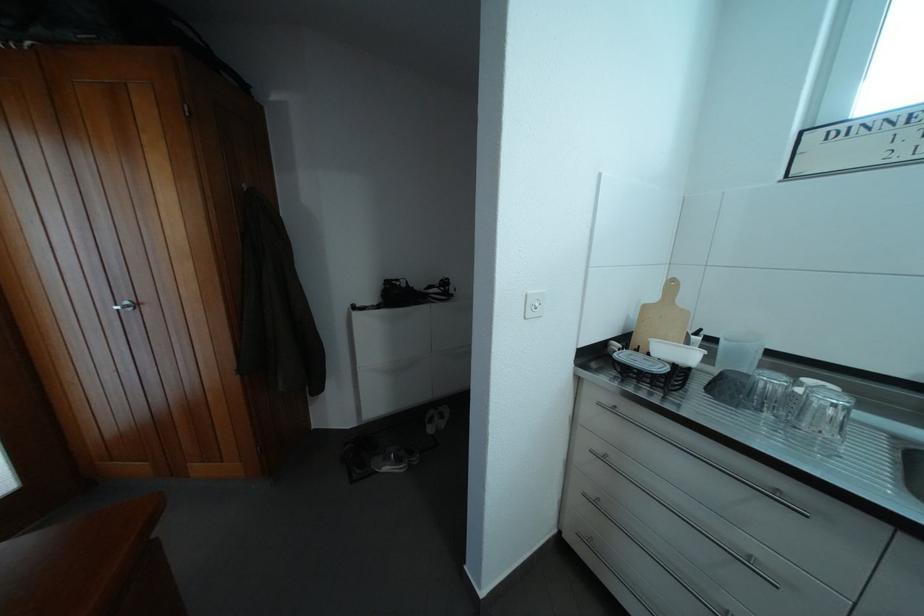
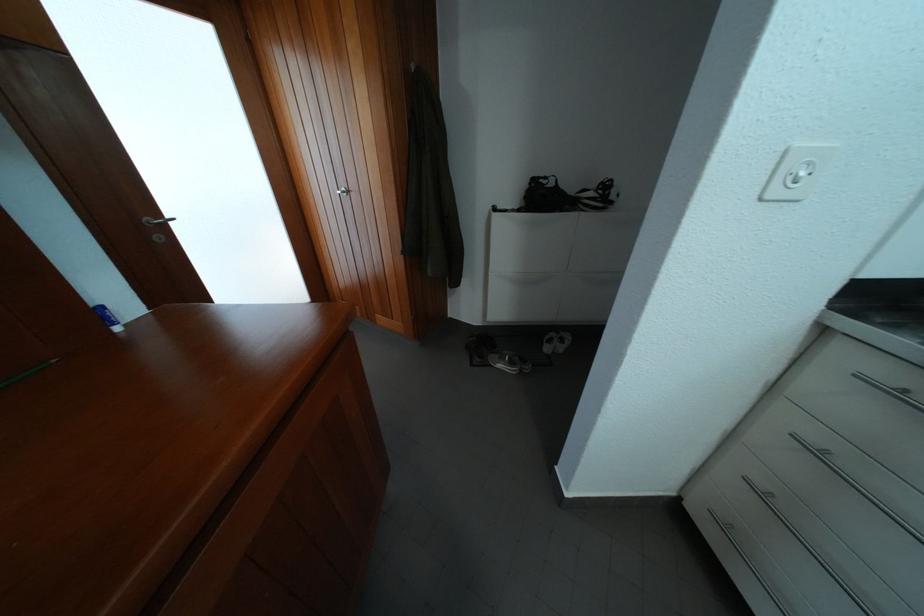
Find the pixel in the second image that matches point (441, 426) in the first image.

(560, 346)